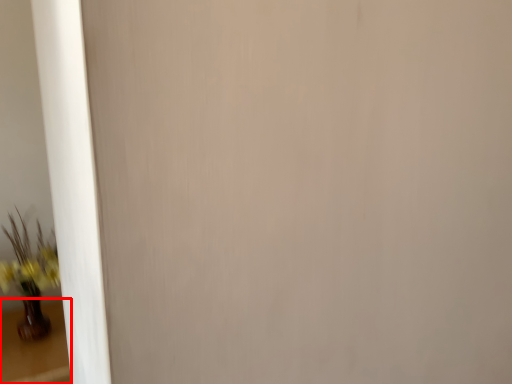
Question: In this image, where is table (annotated by the red box) located relative to houseplant?

Choices:
 (A) right
 (B) left

Answer: (B)